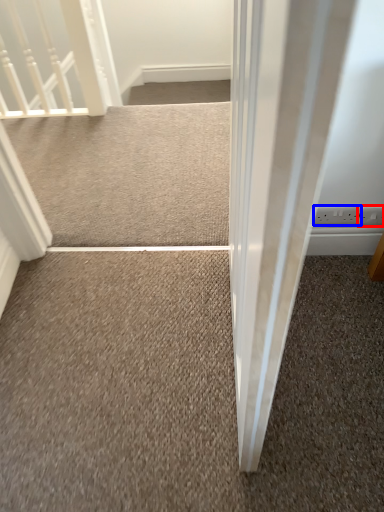
Question: Which object appears closest to the camera in this image, electric outlet (highlighted by a red box) or electric outlet (highlighted by a blue box)?

Choices:
 (A) electric outlet
 (B) electric outlet

Answer: (A)